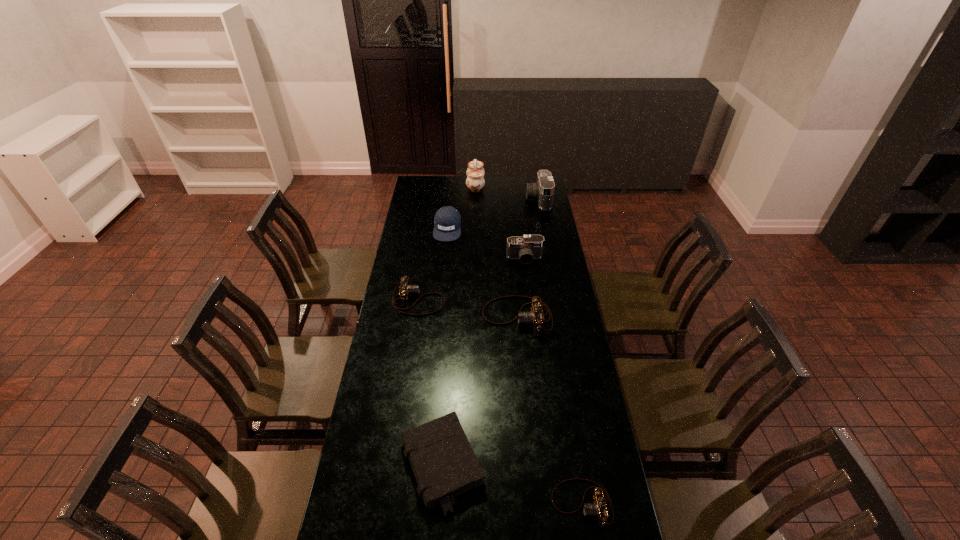
This screenshot has height=540, width=960. Find the location of `free space located on the front-facing side of the third tallest camera`. free space located on the front-facing side of the third tallest camera is located at coordinates (450, 317).

Where is `blank space located on the front-facing side of the third tallest camera`? This screenshot has width=960, height=540. blank space located on the front-facing side of the third tallest camera is located at coordinates tap(455, 317).

Where is `free space located 0.280m on the front-facing side of the third tallest camera`? This screenshot has width=960, height=540. free space located 0.280m on the front-facing side of the third tallest camera is located at coordinates (419, 317).

Where is `vacant area located 0.380m on the front-facing side of the second biggest brown camera`? vacant area located 0.380m on the front-facing side of the second biggest brown camera is located at coordinates (529, 300).

You are a GUI agent. You are given a task and a screenshot of the screen. Output one action in this format:
    pyautogui.click(x=<x>, y=<y>)
    Task: Click on the vacant region located on the back of the Bible
    The height and width of the screenshot is (540, 960).
    Given the screenshot: What is the action you would take?
    pyautogui.click(x=447, y=384)

I want to click on vacant space located on the front-facing side of the nearest brown camera, so click(x=421, y=504).

Identify the location of vacant space positioned on the front-facing side of the nearest brown camera. (457, 504).

The height and width of the screenshot is (540, 960). I want to click on free spot located 0.120m on the front-facing side of the nearest brown camera, so click(x=513, y=504).

The height and width of the screenshot is (540, 960). I want to click on chinaware at the far edge, so click(x=475, y=173).

Locate an element on the screen. Image resolution: width=960 pixels, height=540 pixels. camera at the far edge is located at coordinates (543, 190).